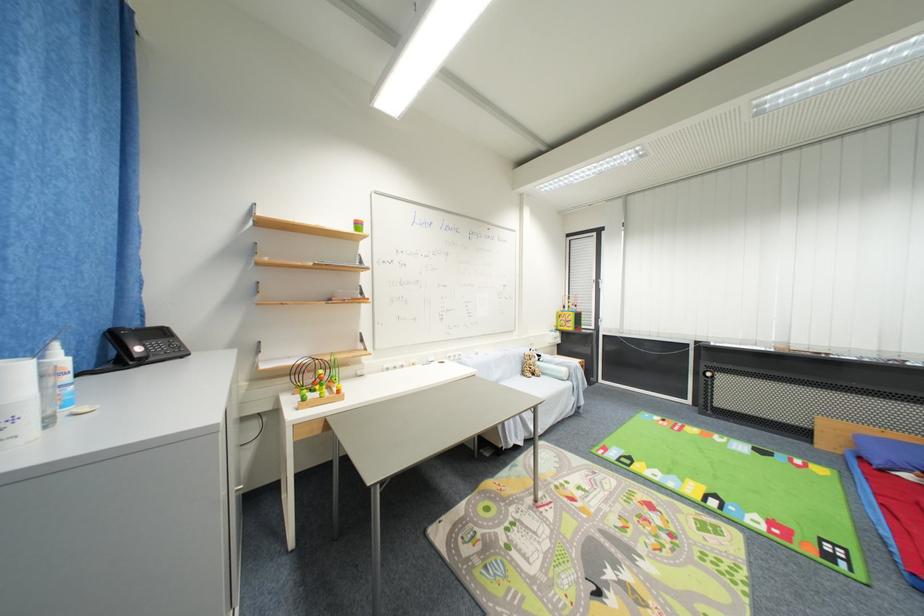
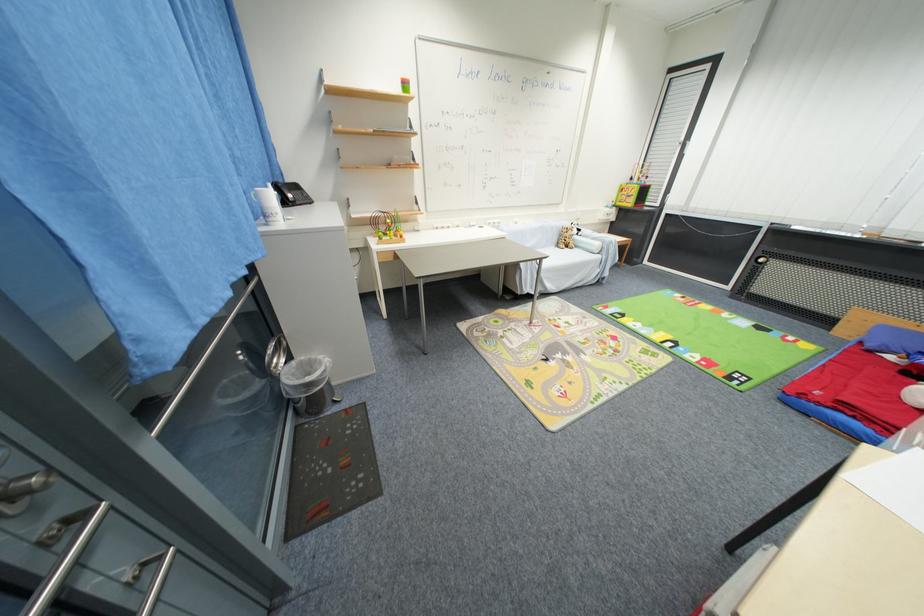
In the second image, find the point that corresponds to point (575, 330) in the first image.

(635, 206)